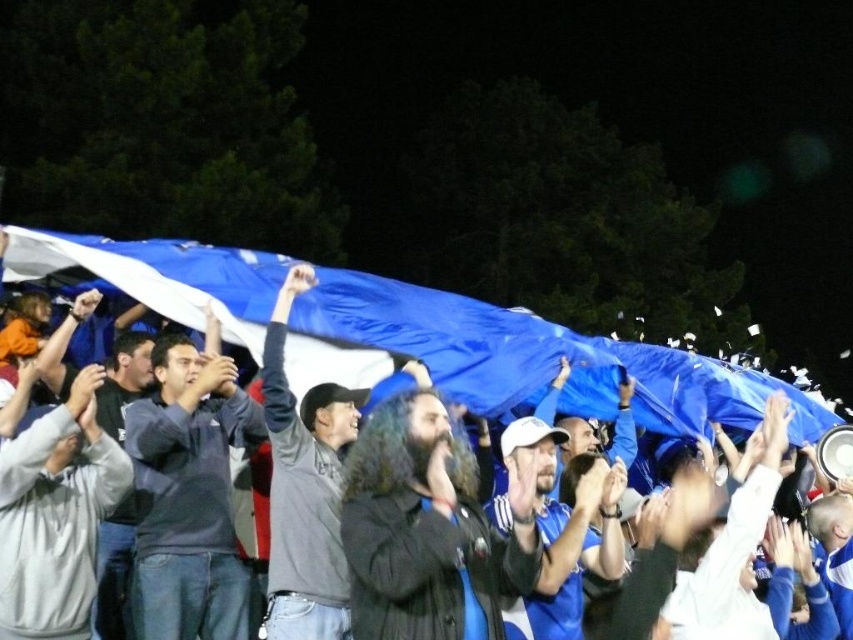
Question: Is dark blue shirt at center above dark gray sweater at center?

Choices:
 (A) yes
 (B) no

Answer: (B)

Question: Which object is positioned closest to the dark blue shirt at center?

Choices:
 (A) white cap at center
 (B) dark gray sweater at center
 (C) dark brown leather jacket at center
 (D) gray fleece sweatshirt at center

Answer: (D)

Question: Which point is farther to the camera?

Choices:
 (A) (21, 588)
 (B) (167, 529)

Answer: (B)

Question: Which point is closer to the camera?

Choices:
 (A) dark blue shirt at center
 (B) white cap at center
 (C) dark brown leather jacket at center

Answer: (C)

Question: Can you confirm if dark blue shirt at center is positioned above dark gray sweater at center?

Choices:
 (A) yes
 (B) no

Answer: (B)

Question: Does blue fabric flag at upper center have a smaller size compared to white cap at center?

Choices:
 (A) no
 (B) yes

Answer: (B)